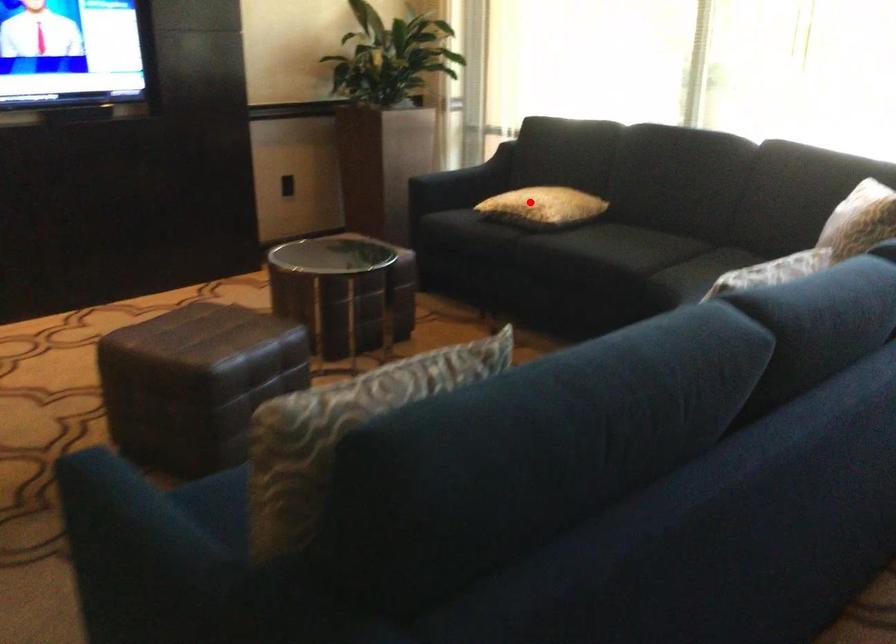
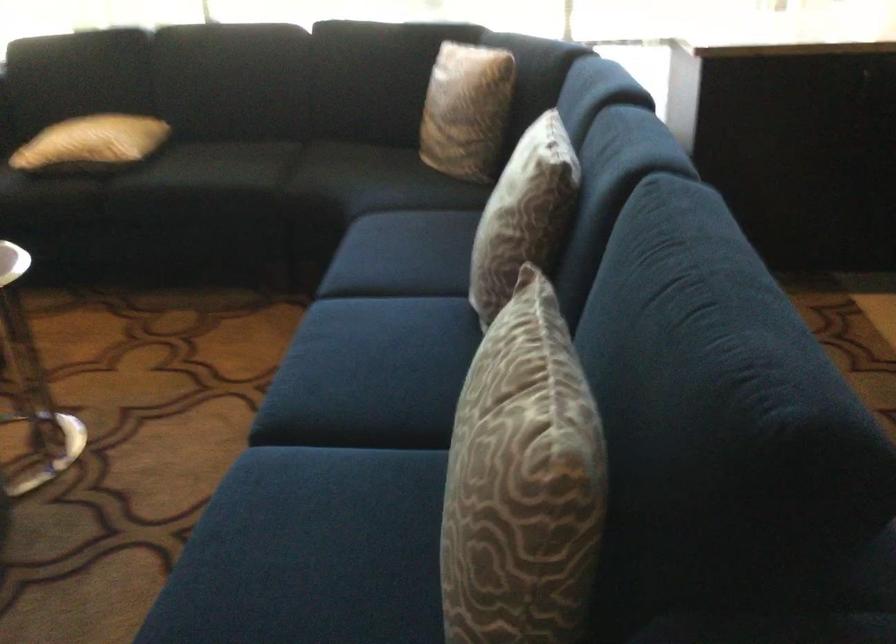
Question: I am providing you with two images of the same scene from different viewpoints. Given a red point in image1, look at the same physical point in image2. Is it:

Choices:
 (A) Closer to the viewpoint
 (B) Farther from the viewpoint

Answer: (A)